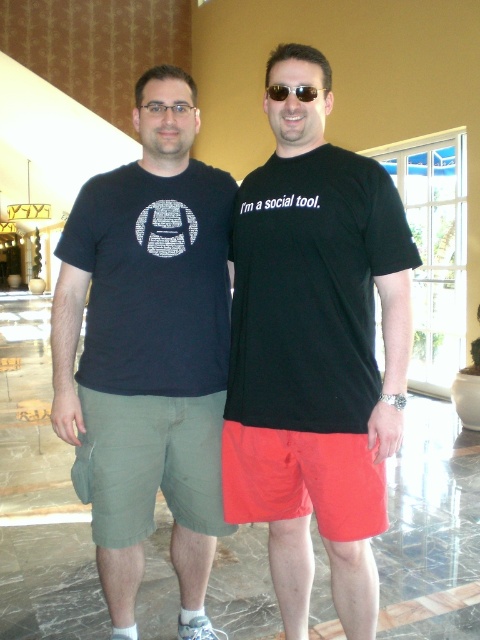
Question: Can you confirm if black cotton t-shirt at center is smaller than sunglasses at center?

Choices:
 (A) yes
 (B) no

Answer: (B)

Question: Estimate the real-world distances between objects in this image. Which object is farther from the sunglasses at center?

Choices:
 (A) black matte t-shirt at center
 (B) black cotton t-shirt at center

Answer: (B)

Question: Among these points, which one is farthest from the camera?

Choices:
 (A) (172, 72)
 (B) (299, 86)

Answer: (A)

Question: Is black cotton t-shirt at center above sunglasses at center?

Choices:
 (A) no
 (B) yes

Answer: (A)

Question: Which of the following is the farthest from the observer?

Choices:
 (A) sunglasses at center
 (B) black matte t-shirt at center

Answer: (A)

Question: Does black matte t-shirt at center appear over black cotton t-shirt at center?

Choices:
 (A) no
 (B) yes

Answer: (B)